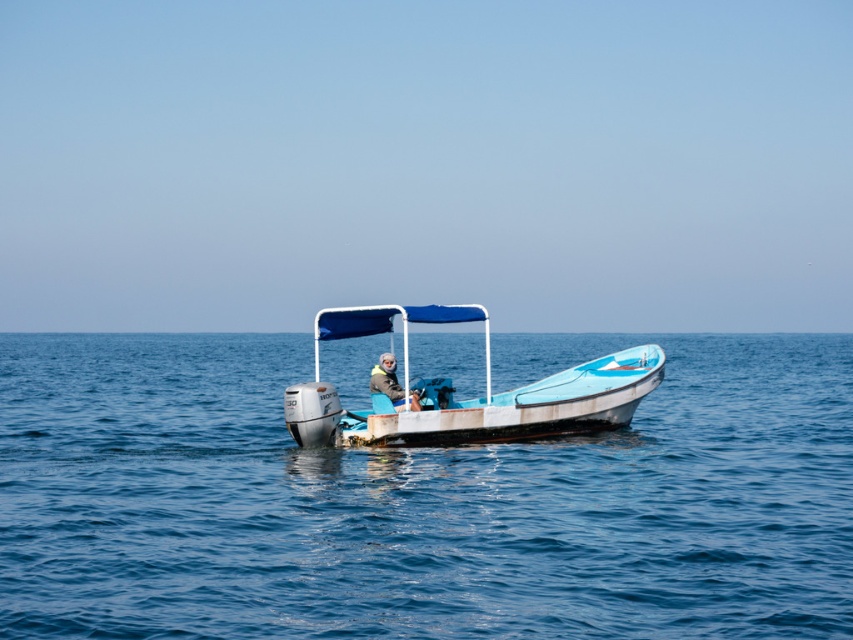
In the scene shown: You are navigating a drone that needs to fly from point A to point B in the motorboat scene. The coordinates for point A are point A at (x=525, y=333) and point B are point B at (x=380, y=307). Considering the boat is in the water, which point should the drone take off from to ensure it doesn???t fly over the boat???s canopy?

The drone should take off from point A at (x=525, y=333) because it is behind point B at (x=380, y=307), so flying from point A would avoid going over the boat???s canopy.

You are navigating a drone to capture aerial footage of the blue water at center. The drone must hover exactly above the coordinates provided in the Objects Description. What are the coordinates where the drone should hover?

The blue water at center is located at point (421, 499), so the drone should hover above those coordinates to capture the blue water at center.

You are navigating a small motorboat and need to drop an anchor at the point marked by coordinates point (421, 499). According to the image, where is this point located?

The point (421, 499) is on blue water at center, so you should drop the anchor there.